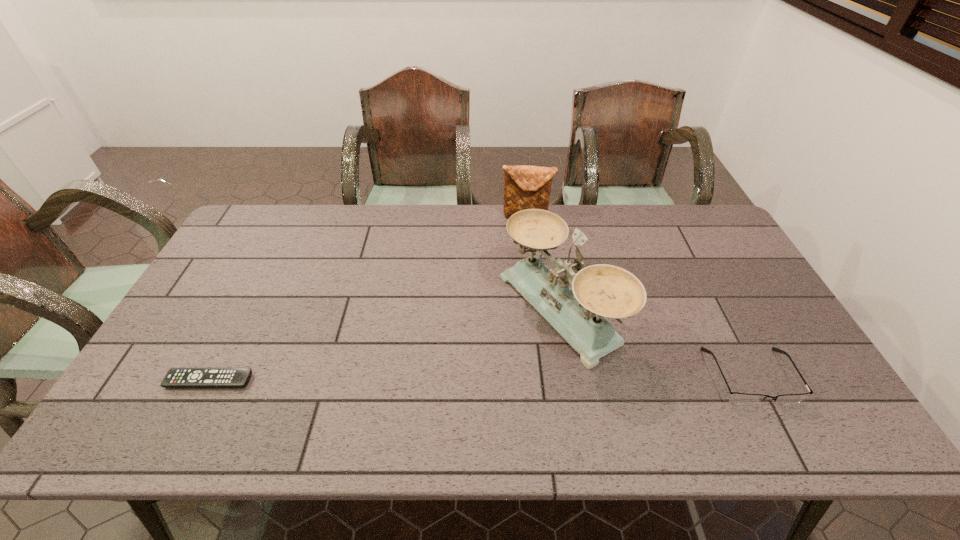
In order to click on the leftmost object in this screenshot , I will do `click(176, 377)`.

Identify the location of the shortest object. 176,377.

Identify the location of the second shortest object. [737, 398].

You are a GUI agent. You are given a task and a screenshot of the screen. Output one action in this format:
    pyautogui.click(x=<x>, y=<y>)
    Task: Click on the rightmost object
    
    Given the screenshot: What is the action you would take?
    pyautogui.click(x=737, y=398)

At what (x,y) coordinates should I click in order to perform the action: click on clutch bag. Please return your answer as a coordinate pair (x, y). This screenshot has height=540, width=960. Looking at the image, I should click on (x=525, y=187).

Locate an element on the screen. The image size is (960, 540). the third shortest object is located at coordinates (525, 187).

Where is `the tallest object`? the tallest object is located at coordinates (601, 290).

Locate an element on the screen. This screenshot has width=960, height=540. vacant area located on the right of the remote control is located at coordinates (401, 381).

This screenshot has width=960, height=540. I want to click on blank space located on the open side of the second tallest object, so click(x=505, y=295).

You are a GUI agent. You are given a task and a screenshot of the screen. Output one action in this format:
    pyautogui.click(x=<x>, y=<y>)
    Task: Click on the vacant position located on the open side of the second tallest object
    The height and width of the screenshot is (540, 960).
    Given the screenshot: What is the action you would take?
    pyautogui.click(x=519, y=234)